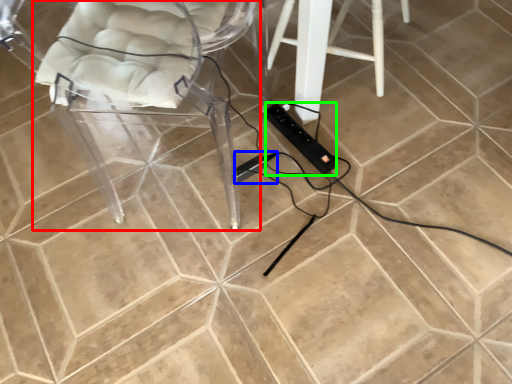
Question: Considering the real-world distances, which object is farthest from chair (highlighted by a red box)? extension cord (highlighted by a blue box) or extension cord (highlighted by a green box)?

Choices:
 (A) extension cord
 (B) extension cord

Answer: (B)